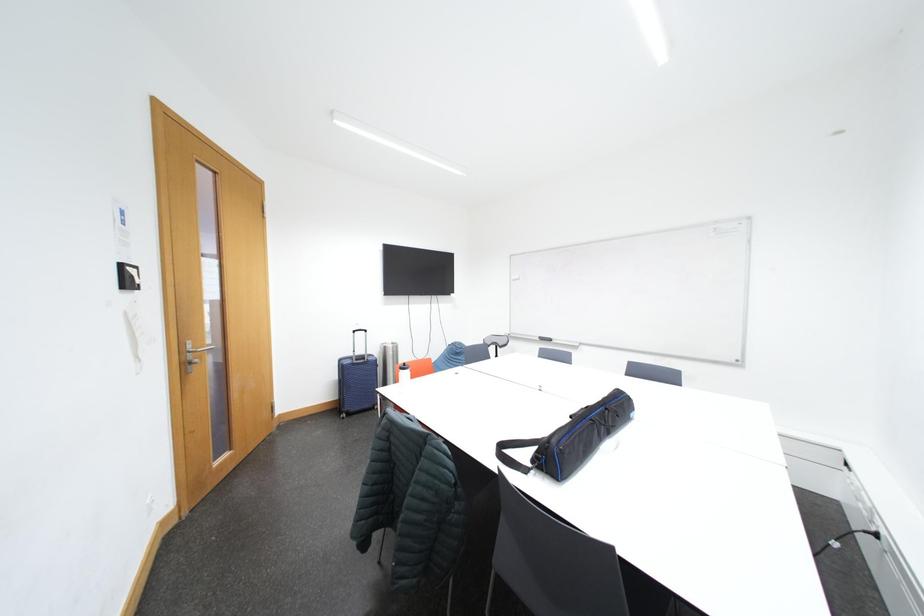
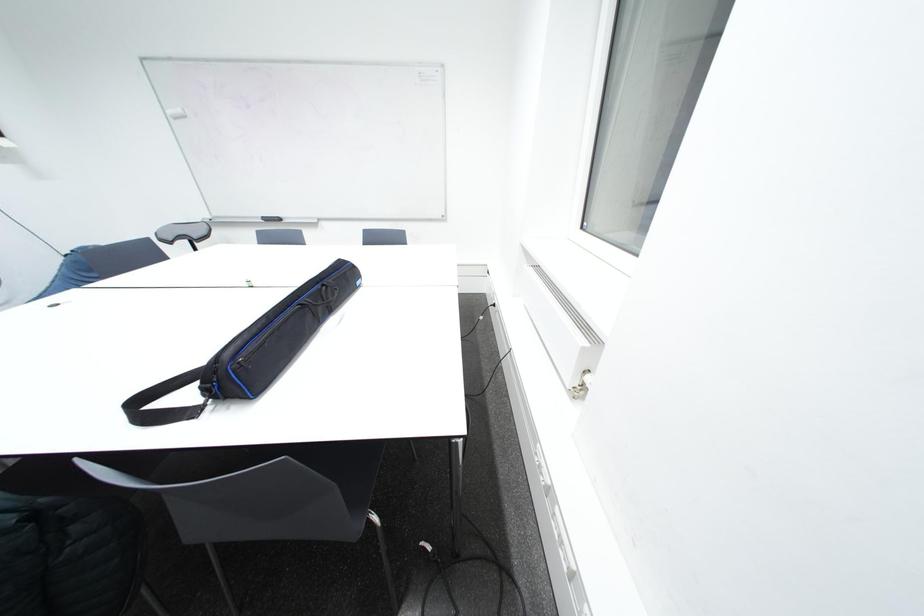
The first image is from the beginning of the video and the second image is from the end. How did the camera likely rotate when shooting the video?

The camera's rotation is toward right-down.